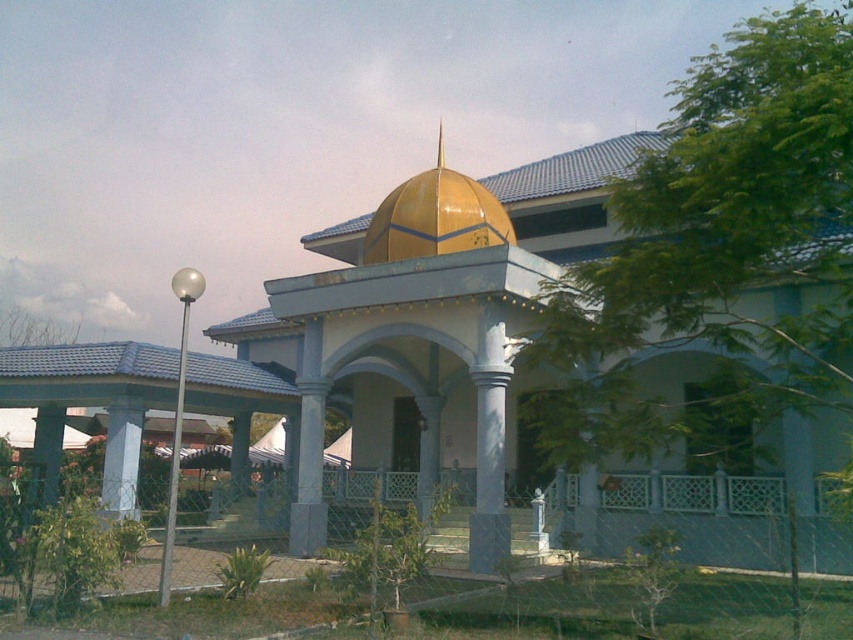
Question: Which of the following is the farthest from the observer?

Choices:
 (A) smooth concrete pillar at center
 (B) white marble column at center

Answer: (A)

Question: Which of the following is the closest to the observer?

Choices:
 (A) (497, 358)
 (B) (772, 470)
 (C) (132, 499)
 (D) (303, 486)

Answer: (A)

Question: Which point is farther to the camera?

Choices:
 (A) matte blue mosque at center
 (B) gold polished dome at center
 (C) smooth concrete pillar at center
 (D) gold shiny dome at center

Answer: (D)

Question: Is white concrete pillar at center above smooth concrete pillar at center?

Choices:
 (A) no
 (B) yes

Answer: (A)

Question: Considering the relative positions of smooth concrete column at center and white concrete pillar at center in the image provided, where is smooth concrete column at center located with respect to white concrete pillar at center?

Choices:
 (A) right
 (B) left

Answer: (A)

Question: Is matte blue mosque at center closer to camera compared to white marble column at center?

Choices:
 (A) no
 (B) yes

Answer: (B)